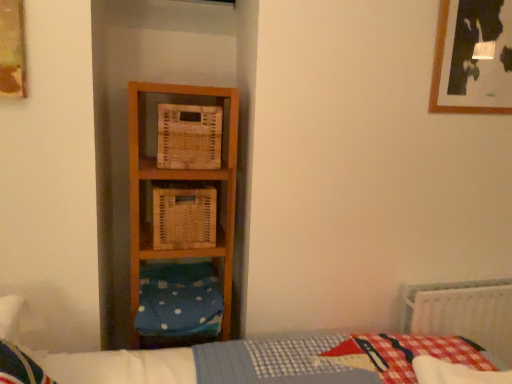
You are a GUI agent. You are given a task and a screenshot of the screen. Output one action in this format:
    pyautogui.click(x=<x>, y=<y>)
    Task: Click on the wooden picture frame at upper right, positioned as the 1th picture frame in right-to-left order
    The height and width of the screenshot is (384, 512).
    Given the screenshot: What is the action you would take?
    pyautogui.click(x=473, y=58)

The width and height of the screenshot is (512, 384). Find the location of `woven wood crate at center, which is counted as the second crate, starting from the bottom`. woven wood crate at center, which is counted as the second crate, starting from the bottom is located at coordinates (189, 137).

Image resolution: width=512 pixels, height=384 pixels. I want to click on woven wicker crate at center, the second crate when ordered from top to bottom, so click(184, 215).

Does point (481, 87) appear closer or farther from the camera than point (11, 22)?

Clearly, point (481, 87) is more distant from the camera than point (11, 22).

From a real-world perspective, which is physically above, wooden picture frame at upper right, the 1th picture frame positioned from the back, or wooden picture frame at upper left, the second picture frame when ordered from right to left?

wooden picture frame at upper right, the 1th picture frame positioned from the back, from a real-world perspective.

Looking at this image, would you consider wooden picture frame at upper right, which ranks as the second picture frame in front-to-back order, to be distant from wooden picture frame at upper left, the 2th picture frame in the back-to-front sequence?

wooden picture frame at upper right, which ranks as the second picture frame in front-to-back order, is positioned a significant distance from wooden picture frame at upper left, the 2th picture frame in the back-to-front sequence.

Considering the relative positions of wooden picture frame at upper right, positioned as the 1th picture frame in right-to-left order, and wooden picture frame at upper left, marked as the 1th picture frame in a left-to-right arrangement, in the image provided, is wooden picture frame at upper right, positioned as the 1th picture frame in right-to-left order, to the left of wooden picture frame at upper left, marked as the 1th picture frame in a left-to-right arrangement, from the viewer's perspective?

In fact, wooden picture frame at upper right, positioned as the 1th picture frame in right-to-left order, is to the right of wooden picture frame at upper left, marked as the 1th picture frame in a left-to-right arrangement.

Is wooden picture frame at upper left, the second picture frame when ordered from right to left, closer to camera compared to white plastic radiator at lower right?

Yes, it is.

Identify the location of picture frame that is the 1st one above the white plastic radiator at lower right (from a real-world perspective). This screenshot has width=512, height=384. (12, 49).

How distant is wooden picture frame at upper left, the 2th picture frame in the back-to-front sequence, from white plastic radiator at lower right?

5.74 feet.

From the image's perspective, would you say wooden picture frame at upper left, marked as the 1th picture frame in a left-to-right arrangement, is shown under white plastic radiator at lower right?

No.

Which object is wider, wooden picture frame at upper left, the 2th picture frame in the back-to-front sequence, or woven wood crate at center, which is counted as the second crate, starting from the bottom?

With larger width is woven wood crate at center, which is counted as the second crate, starting from the bottom.

Between wooden picture frame at upper left, the first picture frame from the front, and woven wood crate at center, which is counted as the second crate, starting from the bottom, which one appears on the left side from the viewer's perspective?

wooden picture frame at upper left, the first picture frame from the front, is more to the left.

Where is `the 1st picture frame above when counting from the woven wood crate at center, which is counted as the second crate, starting from the bottom (from the image's perspective)`? This screenshot has width=512, height=384. the 1st picture frame above when counting from the woven wood crate at center, which is counted as the second crate, starting from the bottom (from the image's perspective) is located at coordinates (12, 49).

Which object is further away from the camera taking this photo, wooden picture frame at upper left, the 2th picture frame in the back-to-front sequence, or woven wood crate at center, acting as the first crate starting from the top?

woven wood crate at center, acting as the first crate starting from the top.

Is woven wicker crate at center, the second crate when ordered from top to bottom, in front of woven wood crate at center, acting as the first crate starting from the top?

No, woven wicker crate at center, the second crate when ordered from top to bottom, is further to the viewer.

Is woven wicker crate at center, which is counted as the first crate, starting from the bottom, beside woven wood crate at center, which is counted as the second crate, starting from the bottom?

There is a gap between woven wicker crate at center, which is counted as the first crate, starting from the bottom, and woven wood crate at center, which is counted as the second crate, starting from the bottom.

Is woven wicker crate at center, the second crate when ordered from top to bottom, positioned with its back to woven wood crate at center, acting as the first crate starting from the top?

No, woven wicker crate at center, the second crate when ordered from top to bottom, is not facing the opposite direction of woven wood crate at center, acting as the first crate starting from the top.

Considering the points (464, 112) and (508, 358), which point is behind, point (464, 112) or point (508, 358)?

Positioned behind is point (508, 358).

Is wooden picture frame at upper right, positioned as the 1th picture frame in right-to-left order, in front of or behind white plastic radiator at lower right in the image?

In the image, wooden picture frame at upper right, positioned as the 1th picture frame in right-to-left order, appears in front of white plastic radiator at lower right.

Can we say wooden picture frame at upper right, positioned as the 1th picture frame in right-to-left order, lies outside white plastic radiator at lower right?

wooden picture frame at upper right, positioned as the 1th picture frame in right-to-left order, lies outside white plastic radiator at lower right's area.

Considering the relative sizes of wooden picture frame at upper right, the 1th picture frame positioned from the back, and white plastic radiator at lower right in the image provided, is wooden picture frame at upper right, the 1th picture frame positioned from the back, thinner than white plastic radiator at lower right?

Yes, wooden picture frame at upper right, the 1th picture frame positioned from the back, is thinner than white plastic radiator at lower right.

The image size is (512, 384). What are the coordinates of `the 1st picture frame above the woven wicker crate at center, the second crate when ordered from top to bottom (from the image's perspective)` in the screenshot? It's located at (12, 49).

From a real-world perspective, is wooden picture frame at upper left, the first picture frame from the front, below woven wicker crate at center, the second crate when ordered from top to bottom?

Actually, wooden picture frame at upper left, the first picture frame from the front, is physically above woven wicker crate at center, the second crate when ordered from top to bottom, in the real world.

From the image's perspective, which one is positioned lower, wooden picture frame at upper left, the second picture frame when ordered from right to left, or woven wicker crate at center, which is counted as the first crate, starting from the bottom?

woven wicker crate at center, which is counted as the first crate, starting from the bottom.

Who is shorter, wooden picture frame at upper left, the first picture frame from the front, or woven wicker crate at center, the second crate when ordered from top to bottom?

woven wicker crate at center, the second crate when ordered from top to bottom.

Between blue polka dot fabric at lower left and white plastic radiator at lower right, which one has larger size?

Bigger between the two is white plastic radiator at lower right.

Are blue polka dot fabric at lower left and white plastic radiator at lower right far apart?

No, blue polka dot fabric at lower left is not far away from white plastic radiator at lower right.

From the image's perspective, which is below, blue polka dot fabric at lower left or white plastic radiator at lower right?

white plastic radiator at lower right appears lower in the image.

Locate an element on the screen. This screenshot has width=512, height=384. radiator behind the blue polka dot fabric at lower left is located at coordinates (464, 313).

Where is `picture frame positioned vertically above the wooden picture frame at upper left, the second picture frame when ordered from right to left (from a real-world perspective)`? picture frame positioned vertically above the wooden picture frame at upper left, the second picture frame when ordered from right to left (from a real-world perspective) is located at coordinates (473, 58).

I want to click on radiator that appears below the wooden picture frame at upper left, the second picture frame when ordered from right to left (from the image's perspective), so pos(464,313).

From the image, which object appears to be farther from wooden picture frame at upper right, which ranks as the second picture frame in front-to-back order, wooden picture frame at upper left, the 2th picture frame in the back-to-front sequence, or woven wood crate at center, acting as the first crate starting from the top?

Among the two, wooden picture frame at upper left, the 2th picture frame in the back-to-front sequence, is located further to wooden picture frame at upper right, which ranks as the second picture frame in front-to-back order.

Considering their positions, is blue polka dot fabric at lower left positioned closer to wooden picture frame at upper right, which ranks as the second picture frame in front-to-back order, than woven wicker crate at center, which is counted as the first crate, starting from the bottom?

woven wicker crate at center, which is counted as the first crate, starting from the bottom, is closer to wooden picture frame at upper right, which ranks as the second picture frame in front-to-back order.

Based on the photo, looking at the image, which one is located further to woven wood crate at center, which is counted as the second crate, starting from the bottom, wooden picture frame at upper left, marked as the 1th picture frame in a left-to-right arrangement, or white plastic radiator at lower right?

The object further to woven wood crate at center, which is counted as the second crate, starting from the bottom, is white plastic radiator at lower right.

Considering their positions, is woven wicker crate at center, which is counted as the first crate, starting from the bottom, positioned further to white plastic radiator at lower right than wooden picture frame at upper left, marked as the 1th picture frame in a left-to-right arrangement?

The object further to white plastic radiator at lower right is wooden picture frame at upper left, marked as the 1th picture frame in a left-to-right arrangement.

Which object lies further to the anchor point white plastic radiator at lower right, wooden picture frame at upper left, marked as the 1th picture frame in a left-to-right arrangement, or woven wicker crate at center, which is counted as the first crate, starting from the bottom?

wooden picture frame at upper left, marked as the 1th picture frame in a left-to-right arrangement.

Which object lies further to the anchor point white plastic radiator at lower right, wooden picture frame at upper left, the first picture frame from the front, or blue polka dot fabric at lower left?

wooden picture frame at upper left, the first picture frame from the front.

Based on their spatial positions, is woven wicker crate at center, the second crate when ordered from top to bottom, or wooden picture frame at upper right, which is the 2th picture frame from left to right, further from white plastic radiator at lower right?

woven wicker crate at center, the second crate when ordered from top to bottom, is positioned further to the anchor white plastic radiator at lower right.

Based on the photo, looking at the image, which one is located closer to wooden picture frame at upper left, marked as the 1th picture frame in a left-to-right arrangement, woven wood crate at center, which is counted as the second crate, starting from the bottom, or wooden picture frame at upper right, the 1th picture frame positioned from the back?

Among the two, woven wood crate at center, which is counted as the second crate, starting from the bottom, is located nearer to wooden picture frame at upper left, marked as the 1th picture frame in a left-to-right arrangement.

Locate an element on the screen. The image size is (512, 384). picture frame between woven wicker crate at center, which is counted as the first crate, starting from the bottom, and white plastic radiator at lower right, in the horizontal direction is located at coordinates (473, 58).

At what (x,y) coordinates should I click in order to perform the action: click on pillow between wooden picture frame at upper left, the first picture frame from the front, and wooden picture frame at upper right, which is the 2th picture frame from left to right. Please return your answer as a coordinate pair (x, y). Image resolution: width=512 pixels, height=384 pixels. Looking at the image, I should click on (179, 300).

Locate an element on the screen. Image resolution: width=512 pixels, height=384 pixels. picture frame situated between woven wood crate at center, acting as the first crate starting from the top, and white plastic radiator at lower right from left to right is located at coordinates (473, 58).

The width and height of the screenshot is (512, 384). What are the coordinates of `crate between woven wood crate at center, acting as the first crate starting from the top, and blue polka dot fabric at lower left vertically` in the screenshot? It's located at click(184, 215).